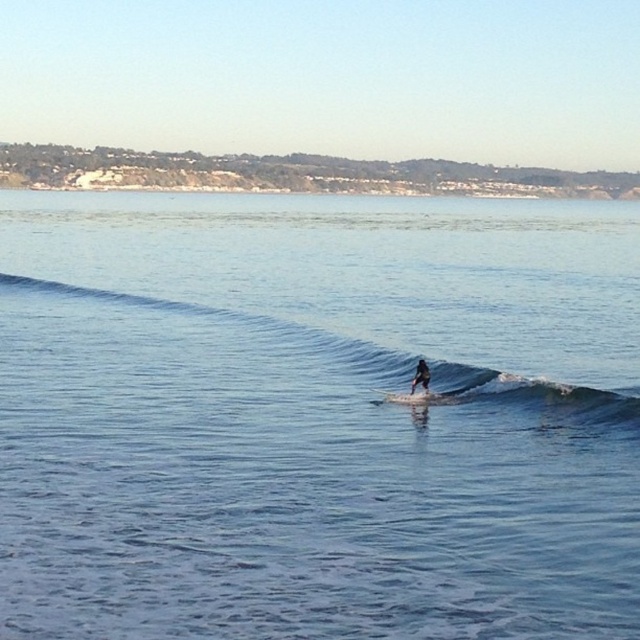
You are a photographer trying to capture the blue smooth wave at center in your shot. The camera has a focus point at coordinate 0.5, 0.37. Will the wave be in focus?

The blue smooth wave at center is at point (237, 330), which is very close to the camera focus point at (236, 320). The wave will be in focus.

You are a photographer trying to capture the surfer in the image. Since the blue water at center and the dark blue wetsuit at center are both at the center, which one is closer to the camera?

The blue water at center is in front of the dark blue wetsuit at center, so the blue water at center is closer to the camera.

Looking at this image, you are a photographer planning to capture the surfer on the black matte surfboard at center. The blue smooth wave at center is in the way. Can you adjust your camera angle to avoid the wave and still see the surfboard?

The blue smooth wave at center is positioned over the black matte surfboard at center, so adjusting the camera angle might not be possible to avoid the wave while still seeing the surfboard.